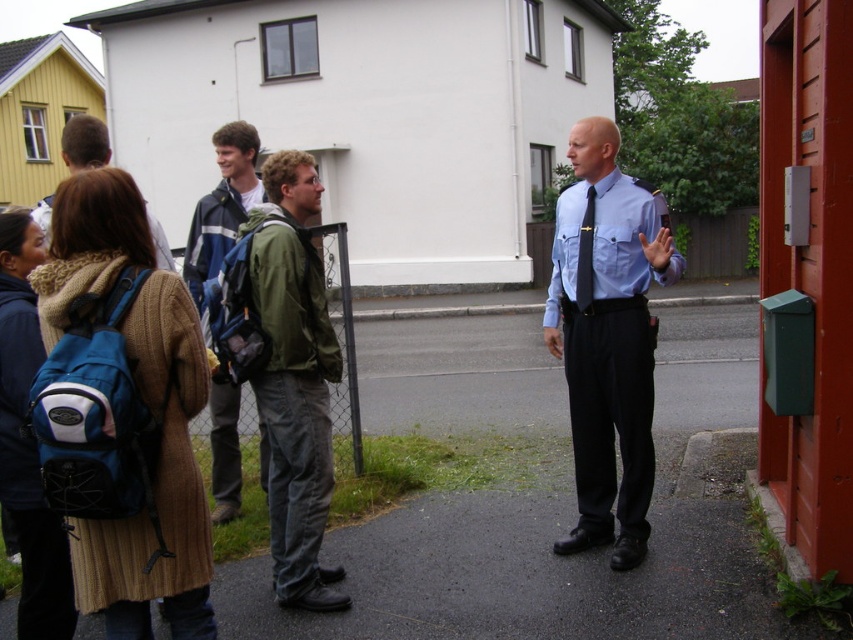
You are a photographer trying to capture a photo of the light blue shirt at center and the brown woolen coat at left. Which one should you focus on first to ensure they are both in sharp focus?

You should focus on the light blue shirt at center first because it is closer to you than the brown woolen coat at left, so focusing on the closer object will help both be in focus.

You are a photographer trying to capture a candid shot of the group without them noticing. You have a camera with a wide angle lens that can capture up to 1.2 meters in width. The green matte jacket at center and the blue backpack at center are both in your frame. Can you fit both objects in your shot if they are positioned side by side?

The green matte jacket at center is wider than the blue backpack at center. Since the camera can capture up to 1.2 meters, you need to check if the combined width of both objects is within this limit. However, the exact widths aren not provided, so it depends on their actual measurements. If the total width is under 1.2 meters, they can fit side by side.

You are a photographer trying to capture a candid shot of the light blue shirt at center and the brown woolen coat at left. Since you want to ensure both are visible in the frame, which subject should you focus on to include both without cropping either?

You should focus on the brown woolen coat at left because it occupies more space than the light blue shirt at center, ensuring both fit within the frame.